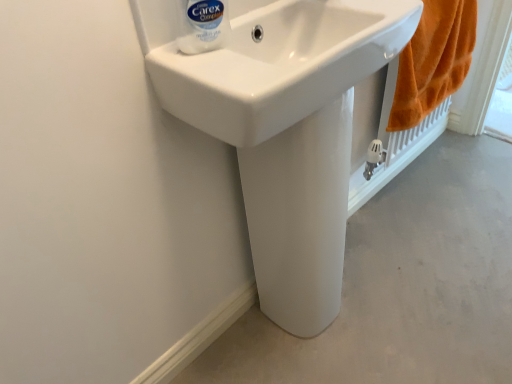
Find the location of a particular element. The width and height of the screenshot is (512, 384). free space to the left of white glossy pedestal at center is located at coordinates (248, 335).